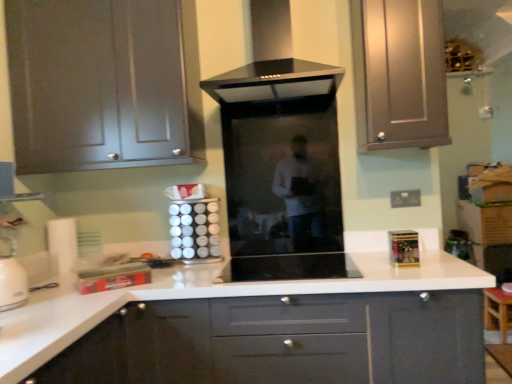
Question: Can you confirm if black glass range hood at center is thinner than metallic silver toaster at lower left, the first appliance when ordered from left to right?

Choices:
 (A) yes
 (B) no

Answer: (B)

Question: From the image's perspective, would you say black glass range hood at center is positioned over metallic silver toaster at lower left, the first appliance when ordered from left to right?

Choices:
 (A) yes
 (B) no

Answer: (A)

Question: Is black glass range hood at center to the left of metallic silver toaster at lower left, the first appliance when ordered from left to right, from the viewer's perspective?

Choices:
 (A) yes
 (B) no

Answer: (B)

Question: Is black glass range hood at center beside metallic silver toaster at lower left, the first appliance when ordered from left to right?

Choices:
 (A) yes
 (B) no

Answer: (B)

Question: Is black glass range hood at center to the right of metallic silver toaster at lower left, which is the 4th appliance in right-to-left order, from the viewer's perspective?

Choices:
 (A) no
 (B) yes

Answer: (B)

Question: Relative to gold metallic spice rack at right, the first appliance when ordered from right to left, is metallic silver toaster at lower left, which is the 4th appliance in right-to-left order, in front or behind?

Choices:
 (A) behind
 (B) front

Answer: (B)

Question: Looking at the image, does metallic silver toaster at lower left, which is the 4th appliance in right-to-left order, seem bigger or smaller compared to gold metallic spice rack at right, the first appliance when ordered from right to left?

Choices:
 (A) big
 (B) small

Answer: (A)

Question: From the image's perspective, is metallic silver toaster at lower left, the first appliance when ordered from left to right, located above or below gold metallic spice rack at right, marked as the 4th appliance in a left-to-right arrangement?

Choices:
 (A) above
 (B) below

Answer: (B)

Question: Does point (137, 284) appear closer or farther from the camera than point (414, 264)?

Choices:
 (A) closer
 (B) farther

Answer: (A)

Question: Is white glossy canisters at center, the 2th appliance from the left, in front of or behind glossy white cabinet at center, which is the 1th cabinetry in bottom-to-top order, in the image?

Choices:
 (A) behind
 (B) front

Answer: (A)

Question: Is white glossy canisters at center, the 2th appliance from the left, situated inside glossy white cabinet at center, which is the 1th cabinetry in bottom-to-top order, or outside?

Choices:
 (A) outside
 (B) inside

Answer: (A)

Question: Visually, is white glossy canisters at center, the 2th appliance from the left, positioned to the left or to the right of glossy white cabinet at center, which is counted as the 3th cabinetry, starting from the top?

Choices:
 (A) left
 (B) right

Answer: (A)

Question: From their relative heights in the image, would you say white glossy canisters at center, the 3th appliance positioned from the right, is taller or shorter than glossy white cabinet at center, which is the 1th cabinetry in bottom-to-top order?

Choices:
 (A) short
 (B) tall

Answer: (A)

Question: From a real-world perspective, is matte gray cabinet at upper left, acting as the 3th cabinetry starting from the bottom, above or below black glass range hood at center?

Choices:
 (A) below
 (B) above

Answer: (A)

Question: Is matte gray cabinet at upper left, acting as the 1th cabinetry starting from the top, inside the boundaries of black glass range hood at center, or outside?

Choices:
 (A) outside
 (B) inside

Answer: (A)